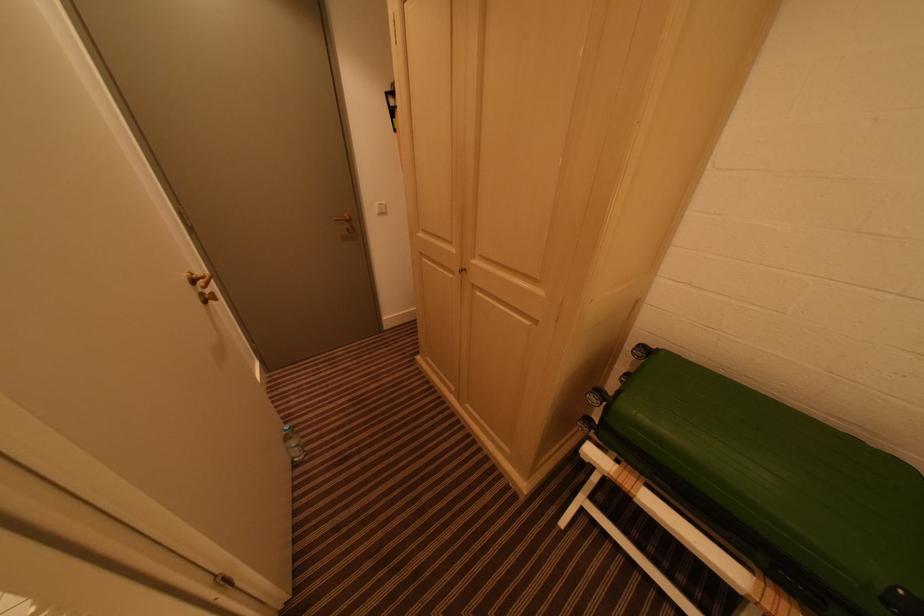
Describe the element at coordinates (198, 280) in the screenshot. I see `the gold door handle` at that location.